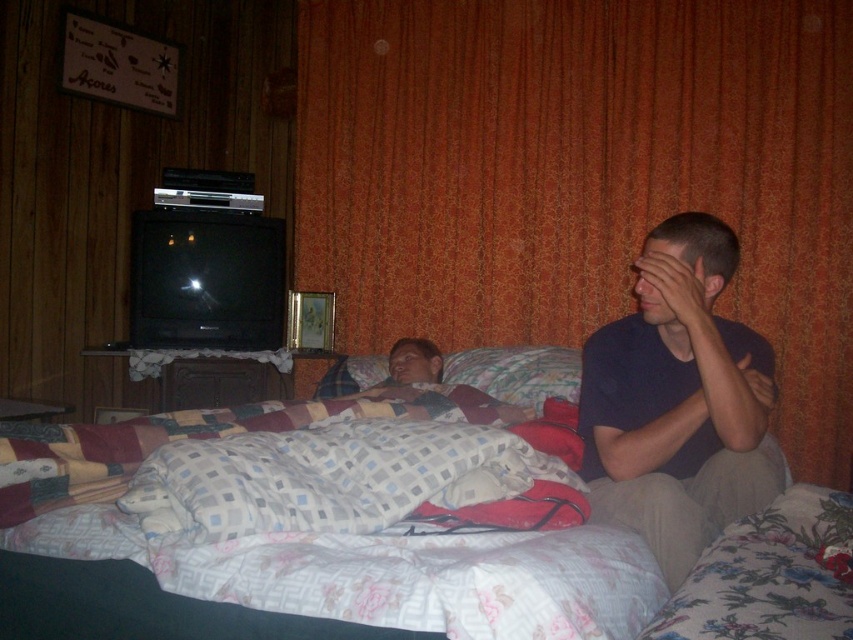
Does orange textured curtain at upper center have a greater height compared to fluffy fabric pillow at center?

Yes, orange textured curtain at upper center is taller than fluffy fabric pillow at center.

Image resolution: width=853 pixels, height=640 pixels. What are the coordinates of `orange textured curtain at upper center` in the screenshot? It's located at (581, 173).

Does point (341, 132) come farther from viewer compared to point (506, 392)?

Yes, it is.

Identify the location of orange textured curtain at upper center. Image resolution: width=853 pixels, height=640 pixels. (581, 173).

Does dark blue shirt at center have a greater width compared to fluffy fabric pillow at center?

Correct, the width of dark blue shirt at center exceeds that of fluffy fabric pillow at center.

Is dark blue shirt at center below fluffy fabric pillow at center?

Yes.

Between point (653, 444) and point (381, 364), which one is positioned in front?

Point (653, 444) is more forward.

Where is `dark blue shirt at center`? The width and height of the screenshot is (853, 640). dark blue shirt at center is located at coordinates (677, 401).

Is fluffy cotton bed at center to the left of fluffy fabric pillow at center from the viewer's perspective?

Yes, fluffy cotton bed at center is to the left of fluffy fabric pillow at center.

In order to click on fluffy cotton bed at center in this screenshot , I will do `click(480, 576)`.